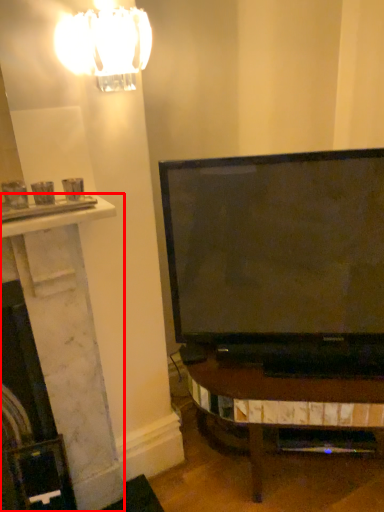
Question: From the image's perspective, what is the correct spatial positioning of fireplace (annotated by the red box) in reference to lamp?

Choices:
 (A) below
 (B) above

Answer: (A)